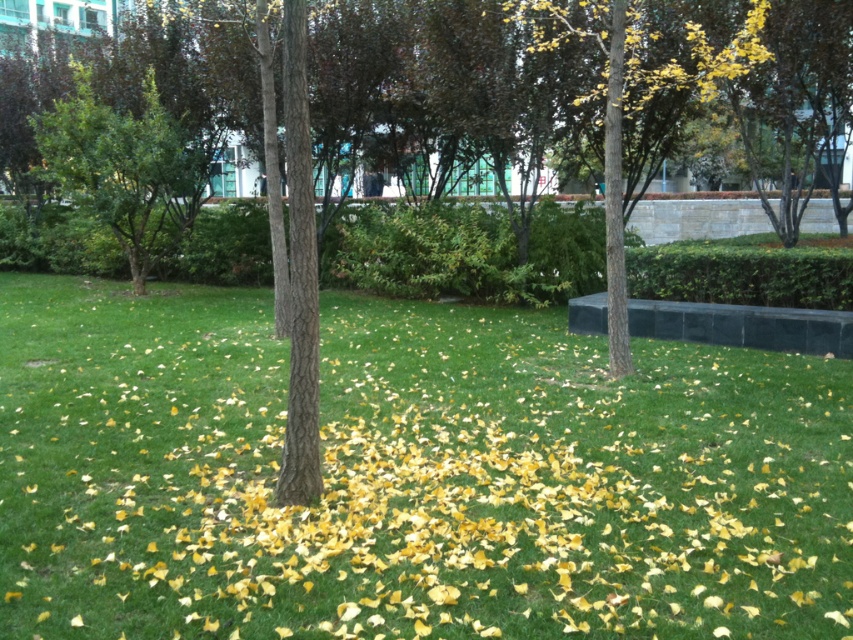
Between point (154, 451) and point (61, 116), which one is positioned in front?

Point (154, 451)

Between yellow leaf litter at center and green leafy tree at left, which one appears on the right side from the viewer's perspective?

From the viewer's perspective, yellow leaf litter at center appears more on the right side.

Is point (480, 372) positioned behind point (67, 113)?

That is False.

Where is `yellow leaf litter at center`? This screenshot has width=853, height=640. yellow leaf litter at center is located at coordinates (408, 476).

Does yellow leaf litter at center come behind yellow-green leaves at center?

No.

Does point (538, 352) lie behind point (722, 58)?

Yes, it is behind point (722, 58).

Does point (279, 442) lie behind point (622, 65)?

No, it is in front of (622, 65).

Where is `yellow leaf litter at center`? yellow leaf litter at center is located at coordinates (408, 476).

Between green leafy tree at left and yellow-green leaves at center, which one is positioned higher?

yellow-green leaves at center

Is green leafy tree at left closer to camera compared to yellow-green leaves at center?

No, it is not.

Does point (96, 163) come behind point (614, 88)?

That is True.

Find the location of `green leafy tree at left`. green leafy tree at left is located at coordinates click(x=125, y=170).